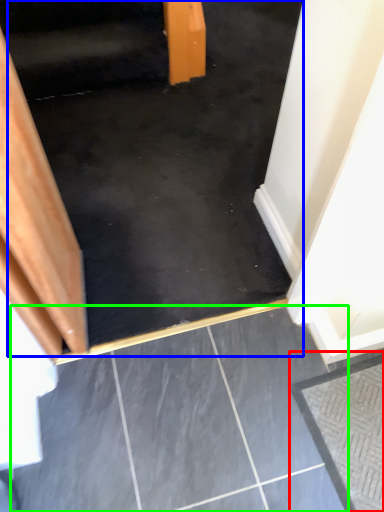
Question: Which object is positioned closest to concrete (highlighted by a red box)? Select from stairs (highlighted by a blue box) and concrete (highlighted by a green box).

Choices:
 (A) stairs
 (B) concrete

Answer: (B)